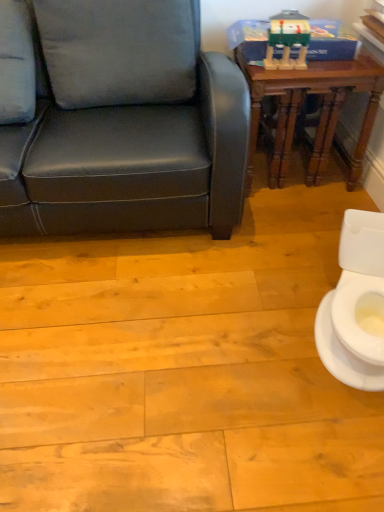
Find the location of `free space behind white glossy toilet at lower right`. free space behind white glossy toilet at lower right is located at coordinates (285, 253).